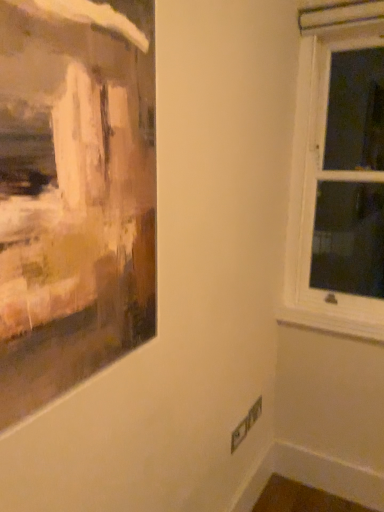
What is the approximate height of white painted wood at lower right?

2.74 inches.

This screenshot has width=384, height=512. What do you see at coordinates (330, 324) in the screenshot? I see `white painted wood at lower right` at bounding box center [330, 324].

The width and height of the screenshot is (384, 512). Find the location of `white painted wood at lower right`. white painted wood at lower right is located at coordinates (330, 324).

The width and height of the screenshot is (384, 512). Describe the element at coordinates (324, 170) in the screenshot. I see `white wooden window at right` at that location.

What is the approximate height of white wooden window at right?

white wooden window at right is 4.13 feet in height.

Identify the location of white wooden window at right. Image resolution: width=384 pixels, height=512 pixels. (324, 170).

Identify the location of white painted wood at lower right. (330, 324).

Which object is positioned more to the right, white painted wood at lower right or white wooden window at right?

Positioned to the right is white wooden window at right.

Between white painted wood at lower right and white wooden window at right, which one is positioned in front?

white wooden window at right is closer to the camera.

Is point (334, 327) positioned after point (317, 318)?

No.

From the image's perspective, is white painted wood at lower right positioned above or below white wooden window at right?

Clearly, from the image's perspective, white painted wood at lower right is below white wooden window at right.

From a real-world perspective, relative to white wooden window at right, is white painted wood at lower right vertically above or below?

Clearly, from a real-world perspective, white painted wood at lower right is below white wooden window at right.

Can you confirm if white painted wood at lower right is thinner than white wooden window at right?

Yes, white painted wood at lower right is thinner than white wooden window at right.

Is white painted wood at lower right taller or shorter than white wooden window at right?

white painted wood at lower right is shorter than white wooden window at right.

Considering the relative sizes of white painted wood at lower right and white wooden window at right in the image provided, is white painted wood at lower right bigger than white wooden window at right?

No.

Would you say white wooden window at right is part of white painted wood at lower right's contents?

Actually, white wooden window at right is outside white painted wood at lower right.

From the picture: Is white painted wood at lower right not near white wooden window at right?

That's not correct — white painted wood at lower right is a little close to white wooden window at right.

Is white painted wood at lower right turned away from white wooden window at right?

white painted wood at lower right does not have its back to white wooden window at right.

How many degrees apart are the facing directions of white painted wood at lower right and white wooden window at right?

0.963 degrees separate the facing orientations of white painted wood at lower right and white wooden window at right.

This screenshot has width=384, height=512. I want to click on window sill behind the white wooden window at right, so click(x=330, y=324).

Is white wooden window at right at the right side of white painted wood at lower right?

Yes.

Between white wooden window at right and white painted wood at lower right, which one is positioned in front?

white wooden window at right.

Which is nearer, (325,76) or (306,326)?

The point (325,76) is more forward.

From the image's perspective, between white wooden window at right and white painted wood at lower right, which one is located above?

From the image's view, white wooden window at right is above.

From a real-world perspective, between white wooden window at right and white painted wood at lower right, who is vertically lower?

In real-world perspective, white painted wood at lower right is lower.

Is white wooden window at right thinner than white painted wood at lower right?

Incorrect, the width of white wooden window at right is not less than that of white painted wood at lower right.

Considering the sizes of white wooden window at right and white painted wood at lower right in the image, is white wooden window at right taller or shorter than white painted wood at lower right?

Clearly, white wooden window at right is taller compared to white painted wood at lower right.

Is white wooden window at right smaller than white painted wood at lower right?

Actually, white wooden window at right might be larger than white painted wood at lower right.

In the scene shown: Is white wooden window at right inside the boundaries of white painted wood at lower right, or outside?

white wooden window at right is located beyond the bounds of white painted wood at lower right.

In the scene shown: Is white wooden window at right positioned far away from white painted wood at lower right?

No, white wooden window at right is not far from white painted wood at lower right.

Is white wooden window at right oriented towards white painted wood at lower right?

No.

Locate an element on the screen. The height and width of the screenshot is (512, 384). window sill that appears below the white wooden window at right (from the image's perspective) is located at coordinates (330, 324).

The height and width of the screenshot is (512, 384). What are the coordinates of `window above the white painted wood at lower right (from the image's perspective)` in the screenshot? It's located at (324, 170).

At what (x,y) coordinates should I click in order to perform the action: click on window sill behind the white wooden window at right. Please return your answer as a coordinate pair (x, y). The image size is (384, 512). Looking at the image, I should click on [330, 324].